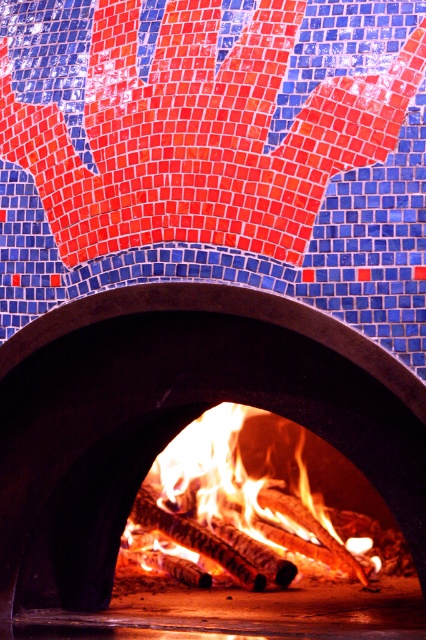
You are a baker who needs to place a new thermometer probe into the oven. The probe must be placed at the exact coordinates of point (178, 413). Where should you place the probe in the black stone oven at center?

Place the thermometer probe at point (178, 413) on the black stone oven at center as specified.

You are a baker who needs to check the oven temperature. You see the black stone oven at center and the flaming wood at center. Which object is closer to the right side of the oven opening?

The flaming wood at center is closer to the right side of the oven opening because the black stone oven at center is to the left of it.

From the picture: You are an interior designer inspecting the oven. You notice a point marked at coordinates (x=216, y=154). What color is the object located at that point?

The point at coordinates (x=216, y=154) marks a blue mosaic tile at upper center.